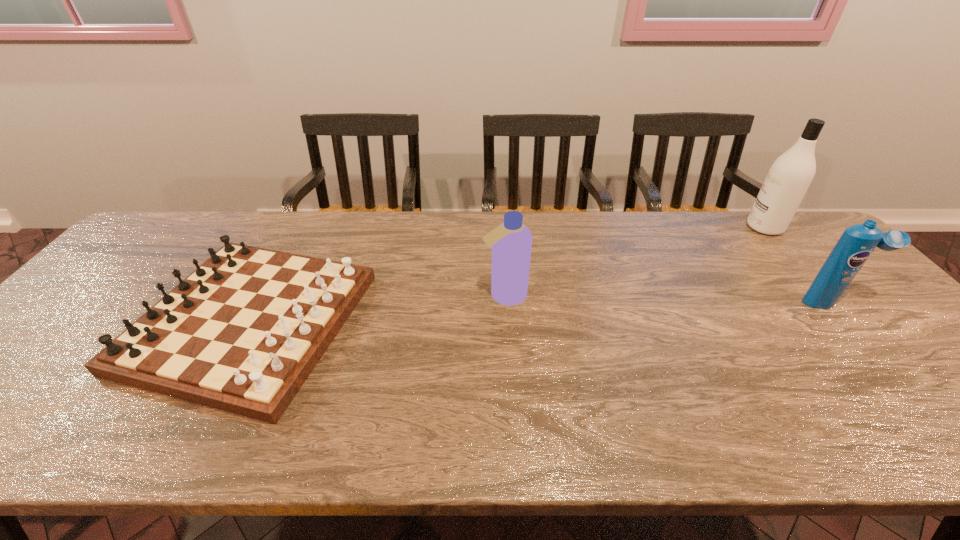
The image size is (960, 540). I want to click on shampoo positioned at the far edge, so click(x=788, y=179).

Where is `chessboard present at the far edge`? chessboard present at the far edge is located at coordinates (242, 333).

The image size is (960, 540). Identify the location of object that is at the near edge. (242, 333).

Locate an element on the screen. object that is at the far right corner is located at coordinates (788, 179).

In the image, there is a desktop. At what (x,y) coordinates should I click in order to perform the action: click on free region at the far edge. Please return your answer as a coordinate pair (x, y). Image resolution: width=960 pixels, height=540 pixels. Looking at the image, I should click on point(415,231).

In the image, there is a desktop. Where is `vacant space at the near edge`? The height and width of the screenshot is (540, 960). vacant space at the near edge is located at coordinates (484, 413).

The image size is (960, 540). Find the location of `free location at the left edge`. free location at the left edge is located at coordinates (58, 390).

At what (x,y) coordinates should I click in order to perform the action: click on vacant space at the right edge. Please return your answer as a coordinate pair (x, y). This screenshot has height=540, width=960. Looking at the image, I should click on (929, 368).

Find the location of a particular element. The height and width of the screenshot is (540, 960). vacant point located between the tallest object and the second object from left to right is located at coordinates (635, 261).

The width and height of the screenshot is (960, 540). Find the location of `vacant space that's between the shortest object and the leftmost shampoo`. vacant space that's between the shortest object and the leftmost shampoo is located at coordinates (377, 308).